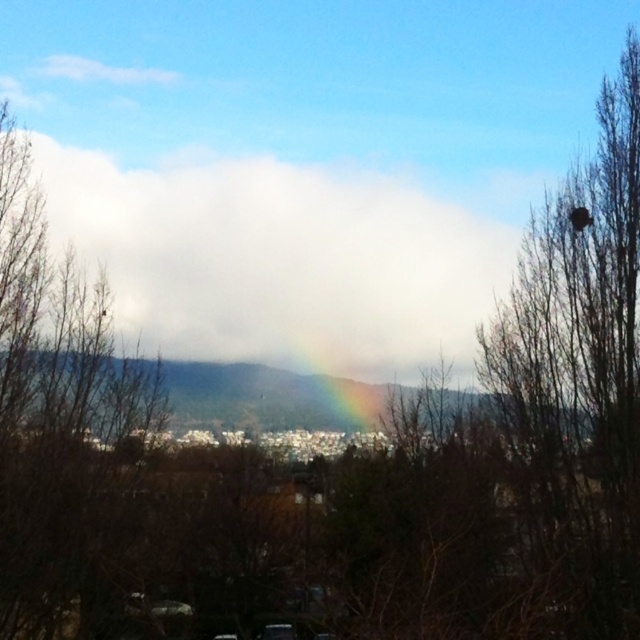
You are standing at the center of the image and want to take a photo of the brown leafless tree at left. Which direction should you turn to face the tree?

The brown leafless tree at left is located at point 0.666 on the x axis and 0.095 on the y axis. Since the x coordinate is 0.666, which is to the right of the center point at 0.5, you should turn to your right to face the tree.

You are standing in the landscape and want to take a photo of both the brown leafless tree at left and the rainbow at center. Can you fit both into your camera frame if your camera has a maximum field of view of 8 meters?

The distance between the brown leafless tree at left and the rainbow at center is 7.72 meters, which is within the camera frame of 8 meters. Therefore, both can be captured in a single photo.

You are a photographer trying to capture the rainbow at center and the brown textured bird nest at upper right in a single shot. Based on their sizes, which object would appear bigger in the photo?

The brown textured bird nest at upper right appears bigger in the photo because its width is larger than that of the rainbow at center.